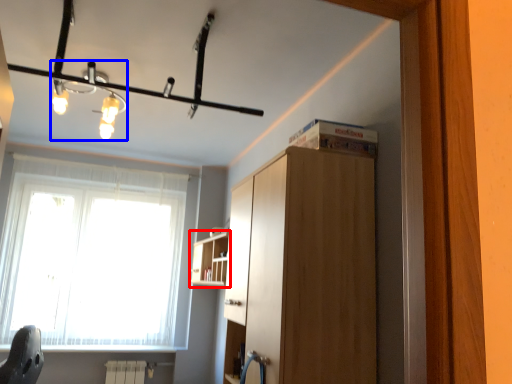
Question: Which point is closer to the camera, shelf (highlighted by a red box) or light fixture (highlighted by a blue box)?

Choices:
 (A) shelf
 (B) light fixture

Answer: (B)